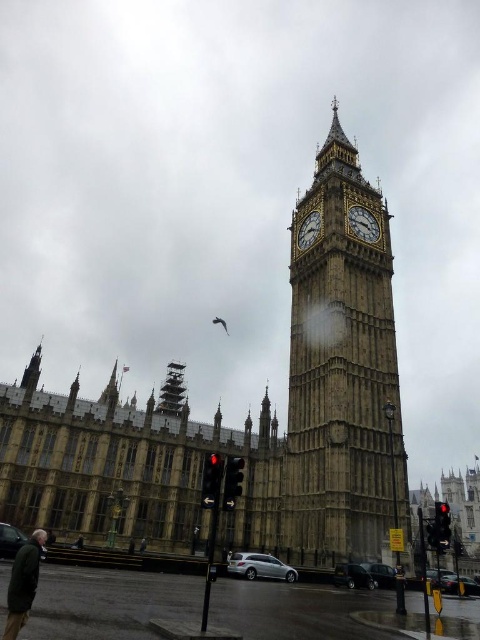
Based on the scene description, where is the point located at coordinates point (342,372)?

The point (342,372) is on the stone clock tower at center.

You are a tourist standing in front of the Elizabeth Tower and want to take a photo that includes both the stone clock tower at center and the gold textured clock at upper center. Which object should you focus on first to ensure both are in frame?

You should focus on the stone clock tower at center first because it is taller than the gold textured clock at upper center, so ensuring the tower is framed properly will naturally include the clock within the shot.

You are a tour guide explaining the scene to visitors. You mention both the shiny black sedan at lower center and the black matte car at lower left. Which car takes up more space in the image?

The black matte car at lower left takes up more space in the image than the shiny black sedan at lower center.